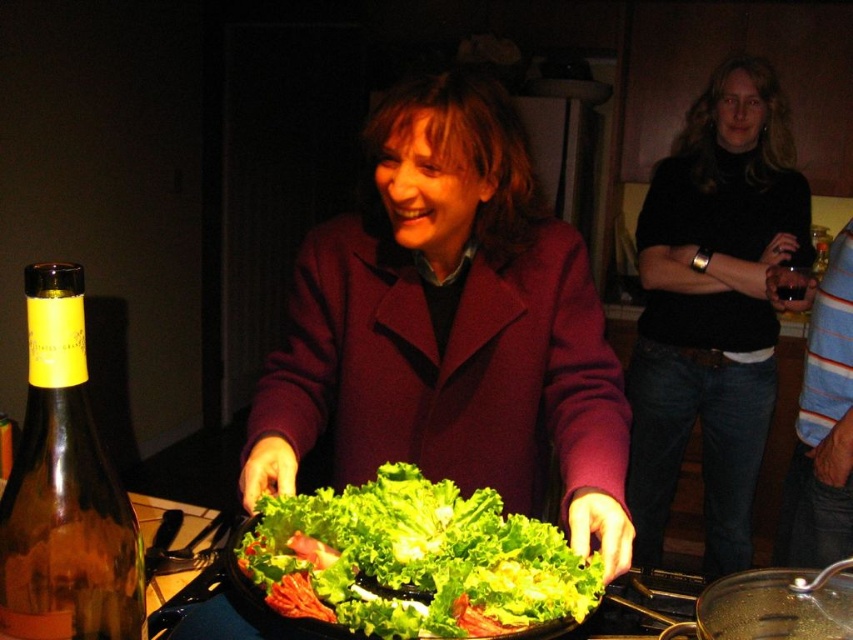
Can you confirm if black turtleneck sweater at center is positioned above amber glass bottle at left?

Yes.

Is black turtleneck sweater at center smaller than amber glass bottle at left?

No, black turtleneck sweater at center is not smaller than amber glass bottle at left.

Find the location of `black turtleneck sweater at center`. black turtleneck sweater at center is located at coordinates (712, 307).

Based on the photo, can you confirm if matte purple coat at center is thinner than striped cotton shirt at lower right?

In fact, matte purple coat at center might be wider than striped cotton shirt at lower right.

The width and height of the screenshot is (853, 640). What do you see at coordinates (450, 326) in the screenshot?
I see `matte purple coat at center` at bounding box center [450, 326].

Which is behind, point (397, 211) or point (817, 355)?

Point (817, 355)

The width and height of the screenshot is (853, 640). In order to click on matte purple coat at center in this screenshot , I will do `click(450, 326)`.

Between amber glass bottle at left and transparent glass wok at lower right, which one has more height?

amber glass bottle at left is taller.

Between point (51, 509) and point (759, 630), which one is positioned behind?

Point (759, 630)

What are the coordinates of `amber glass bottle at left` in the screenshot? It's located at (64, 490).